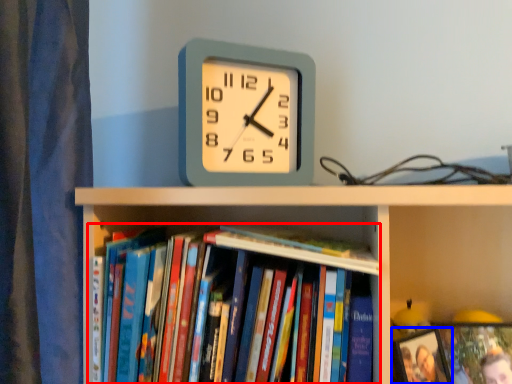
Question: Which object is further to the camera taking this photo, book (highlighted by a red box) or picture frame (highlighted by a blue box)?

Choices:
 (A) book
 (B) picture frame

Answer: (B)